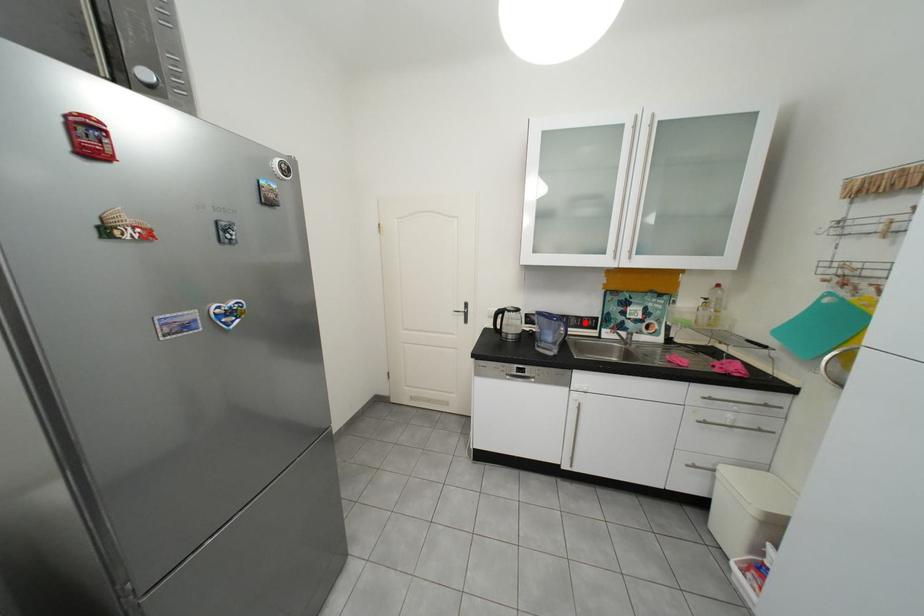
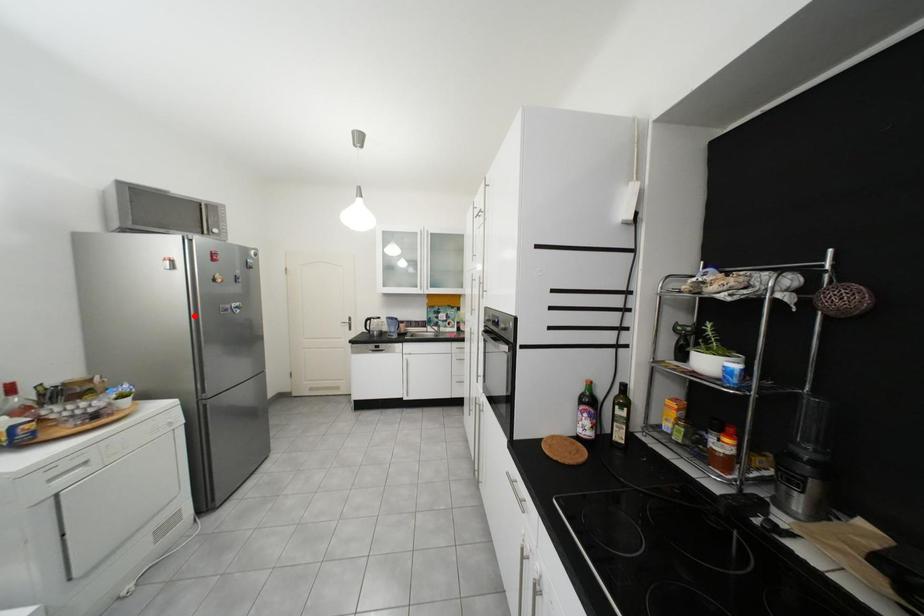
I am providing you with two images of the same scene from different viewpoints. A red point is marked on the first image and another point is marked on the second image. Do the highlighted points in image1 and image2 indicate the same real-world spot?

No